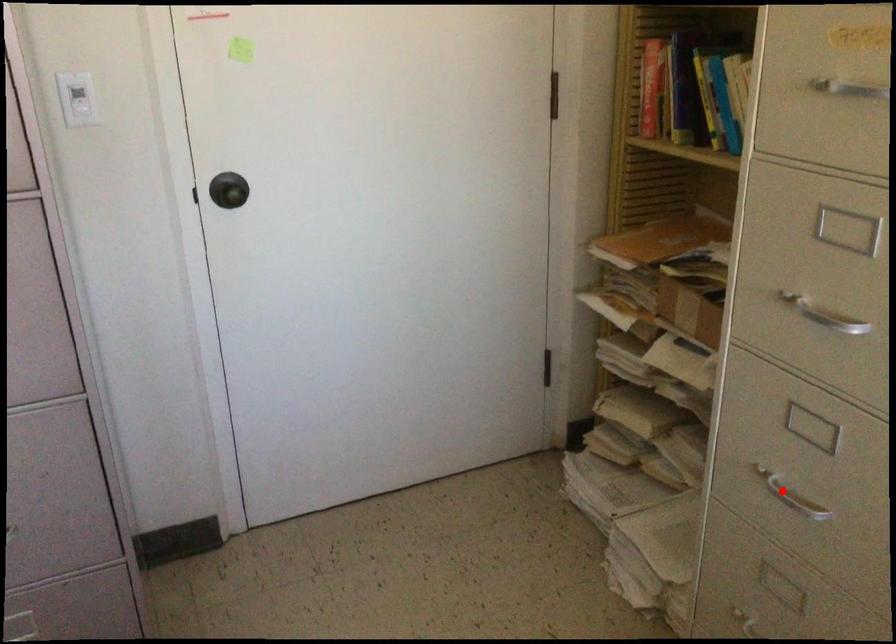
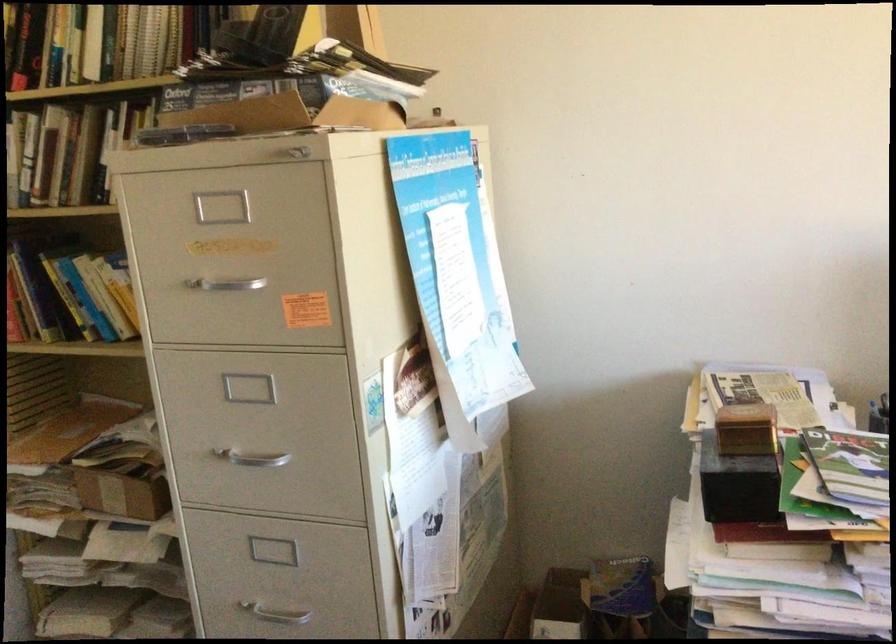
Question: I am providing you with two images of the same scene from different viewpoints. In image1, a red point is highlighted. Considering the same 3D point in image2, which of the following is correct?

Choices:
 (A) It is closer
 (B) It is farther

Answer: (B)